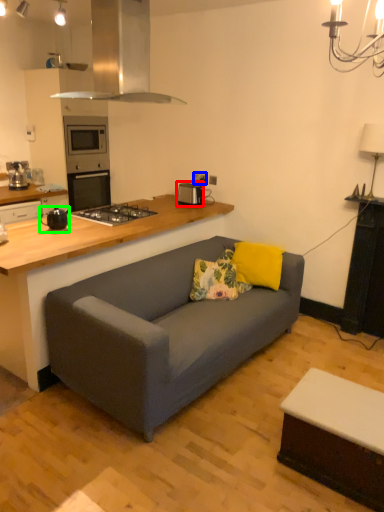
Question: Which object is the farthest from appliance (highlighted by a red box)? Choose among these: electric outlet (highlighted by a blue box) or appliance (highlighted by a green box).

Choices:
 (A) electric outlet
 (B) appliance

Answer: (B)